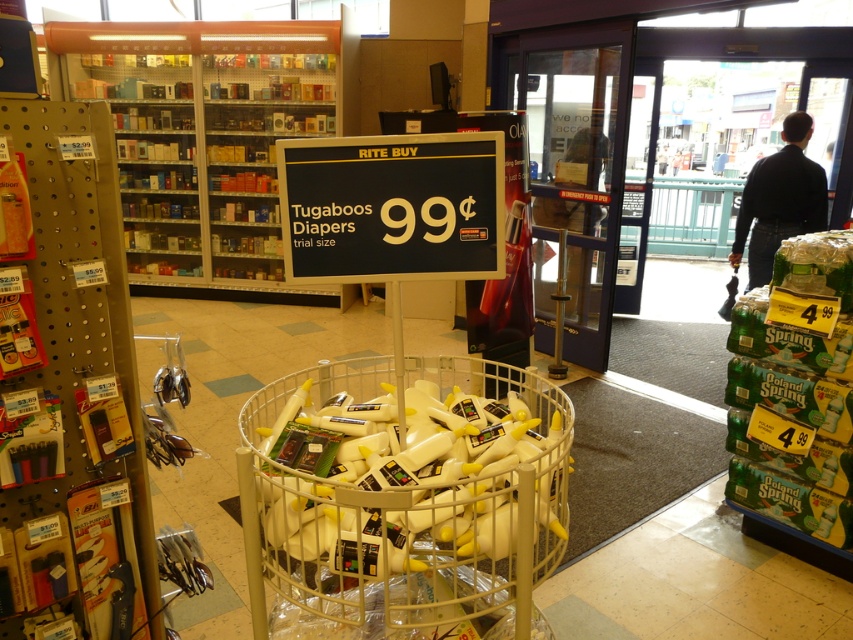
Question: Does metallic silver shelves at upper left appear under black plastic sign at center?

Choices:
 (A) yes
 (B) no

Answer: (B)

Question: In this image, where is metallic silver shelves at upper left located relative to black plastic sign at center?

Choices:
 (A) below
 (B) above

Answer: (B)

Question: Which object appears closest to the camera in this image?

Choices:
 (A) metallic silver shelves at upper left
 (B) black plastic sign at center

Answer: (B)

Question: Which object is closer to the camera taking this photo?

Choices:
 (A) black plastic sign at center
 (B) metallic silver shelves at upper left

Answer: (A)

Question: Can you confirm if metallic silver shelves at upper left is bigger than black plastic sign at center?

Choices:
 (A) no
 (B) yes

Answer: (B)